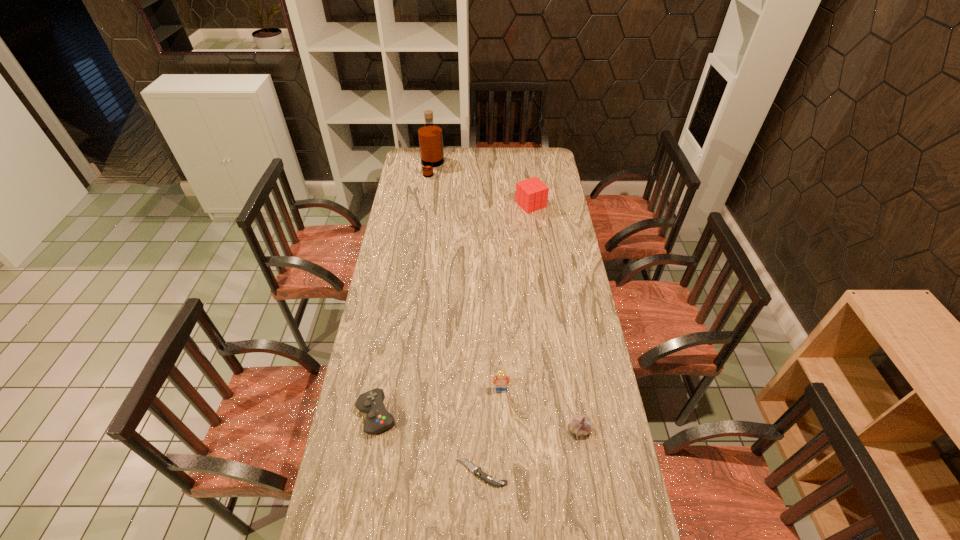
You are a GUI agent. You are given a task and a screenshot of the screen. Output one action in this format:
    pyautogui.click(x=<x>, y=<y>)
    Task: Click on the free space at the left edge of the desktop
    
    Given the screenshot: What is the action you would take?
    pyautogui.click(x=423, y=186)

Locate an element on the screen. free spot at the right edge of the desktop is located at coordinates (593, 420).

At what (x,y) coordinates should I click in order to perform the action: click on free region at the far right corner of the desktop. Please return your answer as a coordinate pair (x, y). Looking at the image, I should click on (531, 152).

The height and width of the screenshot is (540, 960). Identify the location of unoccupied area between the cube and the Lego. (516, 297).

This screenshot has height=540, width=960. Identify the location of vacant region between the control and the tallest object. 404,291.

Where is `vacant space in between the nearest object and the liquor`? The height and width of the screenshot is (540, 960). vacant space in between the nearest object and the liquor is located at coordinates (457, 320).

Find the location of a particular element. This screenshot has width=960, height=540. vacant space in between the second shortest object and the cube is located at coordinates (454, 309).

I want to click on free area in between the Lego and the cube, so click(x=516, y=297).

Where is `free space between the garlic and the shortest object`? The width and height of the screenshot is (960, 540). free space between the garlic and the shortest object is located at coordinates (531, 451).

Locate an element on the screen. The image size is (960, 540). free space between the Lego and the third shortest object is located at coordinates (540, 409).